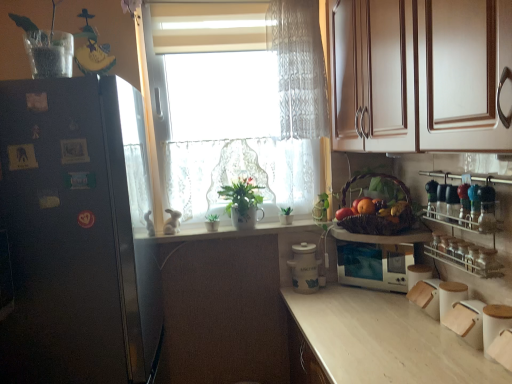
Where is `vacant point above white ceramic pots at center (from a real-world perspective)`? vacant point above white ceramic pots at center (from a real-world perspective) is located at coordinates (242, 228).